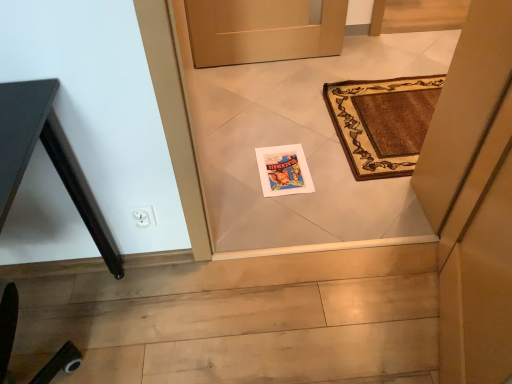
Identify the location of black matte table at left. This screenshot has height=384, width=512. (48, 155).

The image size is (512, 384). What do you see at coordinates (48, 155) in the screenshot? I see `black matte table at left` at bounding box center [48, 155].

Measure the distance between point [6,203] and camera.

Point [6,203] is 30.20 inches away from camera.

Find the location of a particular element. This screenshot has width=512, height=384. matte paper postcard at center is located at coordinates (283, 170).

Describe the element at coordinates (283, 170) in the screenshot. The image size is (512, 384). I see `matte paper postcard at center` at that location.

Measure the distance between matte paper postcard at center and camera.

They are 1.68 meters apart.

This screenshot has height=384, width=512. What are the coordinates of `black matte table at left` in the screenshot? It's located at (48, 155).

Considering the relative positions of black matte table at left and matte paper postcard at center in the image provided, is black matte table at left to the left or to the right of matte paper postcard at center?

Clearly, black matte table at left is on the left of matte paper postcard at center in the image.

Is black matte table at left in front of matte paper postcard at center?

Yes, black matte table at left is in front of matte paper postcard at center.

Does point (2, 107) come behind point (261, 162)?

That is False.

From the image's perspective, which is above, black matte table at left or matte paper postcard at center?

matte paper postcard at center is shown above in the image.

From a real-world perspective, is black matte table at left positioned above or below matte paper postcard at center?

black matte table at left is situated higher than matte paper postcard at center in the real world.

Can you confirm if black matte table at left is thinner than matte paper postcard at center?

Incorrect, the width of black matte table at left is not less than that of matte paper postcard at center.

In terms of height, does black matte table at left look taller or shorter compared to matte paper postcard at center?

Clearly, black matte table at left is taller compared to matte paper postcard at center.

Considering the sizes of black matte table at left and matte paper postcard at center in the image, is black matte table at left bigger or smaller than matte paper postcard at center?

Clearly, black matte table at left is larger in size than matte paper postcard at center.

Is black matte table at left spatially inside matte paper postcard at center, or outside of it?

The correct answer is: outside.

Is black matte table at left not close to matte paper postcard at center?

That's not correct — black matte table at left is a little close to matte paper postcard at center.

Is black matte table at left positioned with its back to matte paper postcard at center?

No, black matte table at left is not facing the opposite direction of matte paper postcard at center.

How much distance is there between black matte table at left and matte paper postcard at center?

30.70 inches.

In order to click on postcard that appears on the right of black matte table at left in this screenshot , I will do `click(283, 170)`.

Is matte paper postcard at center at the right side of black matte table at left?

Indeed, matte paper postcard at center is positioned on the right side of black matte table at left.

Does matte paper postcard at center come behind black matte table at left?

Yes, it is behind black matte table at left.

Considering the positions of point (297, 180) and point (8, 209), is point (297, 180) closer or farther from the camera than point (8, 209)?

Clearly, point (297, 180) is more distant from the camera than point (8, 209).

From the image's perspective, relative to black matte table at left, is matte paper postcard at center above or below?

matte paper postcard at center is situated higher than black matte table at left in the image.

From a real-world perspective, which object stands above the other?

In real-world perspective, black matte table at left is above.

Between matte paper postcard at center and black matte table at left, which one has larger width?

Wider between the two is black matte table at left.

Between matte paper postcard at center and black matte table at left, which one has less height?

Standing shorter between the two is matte paper postcard at center.

Who is bigger, matte paper postcard at center or black matte table at left?

black matte table at left is bigger.

Would you say black matte table at left is part of matte paper postcard at center's contents?

Definitely not — black matte table at left is not inside matte paper postcard at center.

Is matte paper postcard at center far from black matte table at left?

No, matte paper postcard at center is in close proximity to black matte table at left.

Does matte paper postcard at center turn towards black matte table at left?

No, matte paper postcard at center is not turned towards black matte table at left.

Locate an element on the screen. This screenshot has height=384, width=512. postcard behind the black matte table at left is located at coordinates (283, 170).

Find the location of a particular element. table on the left of the matte paper postcard at center is located at coordinates (48, 155).

Locate an element on the screen. table that is above the matte paper postcard at center (from a real-world perspective) is located at coordinates (48, 155).